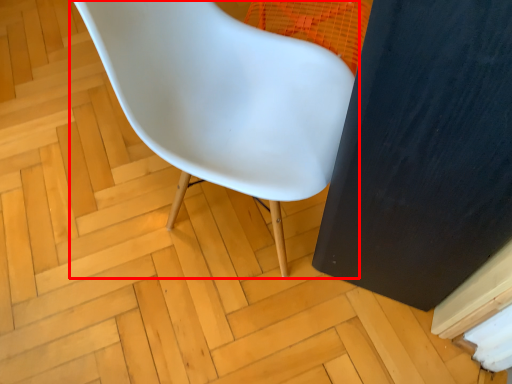
Question: From the image's perspective, considering the relative positions of chair (annotated by the red box) and screen door in the image provided, where is chair (annotated by the red box) located with respect to the staircase?

Choices:
 (A) above
 (B) below

Answer: (A)